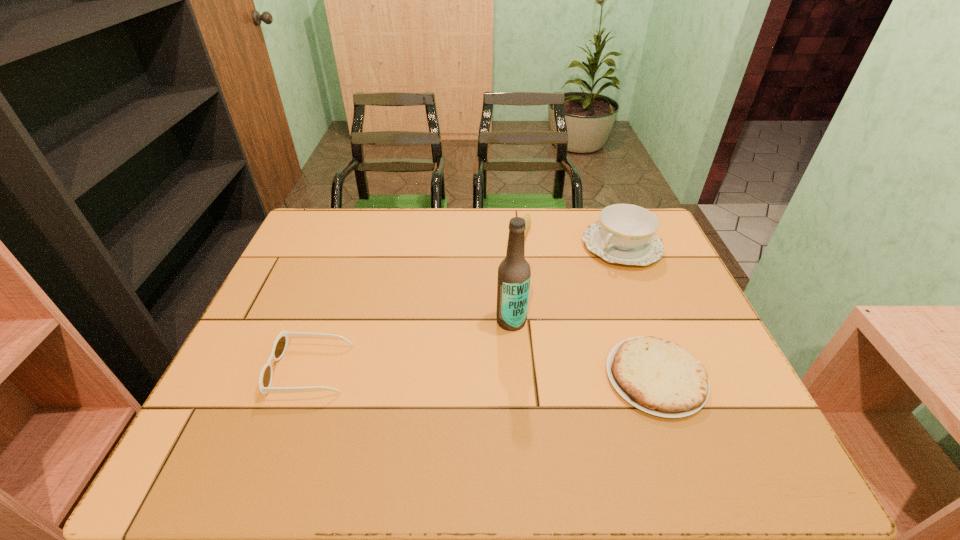
At what (x,y) coordinates should I click in order to perform the action: click on sunglasses that is at the near edge. Please return your answer as a coordinate pair (x, y). Image resolution: width=960 pixels, height=540 pixels. Looking at the image, I should click on (280, 345).

You are a GUI agent. You are given a task and a screenshot of the screen. Output one action in this format:
    pyautogui.click(x=<x>, y=<y>)
    Task: Click on the tortilla at the near edge
    This screenshot has height=540, width=960.
    Given the screenshot: What is the action you would take?
    pyautogui.click(x=659, y=377)

Identify the location of object situated at the left edge. The image size is (960, 540). (280, 345).

The image size is (960, 540). I want to click on tortilla positioned at the right edge, so click(659, 377).

Image resolution: width=960 pixels, height=540 pixels. I want to click on chinaware located in the right edge section of the desktop, so click(626, 234).

Where is `object positioned at the near left corner`? This screenshot has height=540, width=960. object positioned at the near left corner is located at coordinates (280, 345).

Where is `object that is positioned at the far right corner`? The image size is (960, 540). object that is positioned at the far right corner is located at coordinates (626, 234).

Locate an element on the screen. object at the near right corner is located at coordinates (659, 377).

Locate an element on the screen. This screenshot has width=960, height=540. vacant space at the far edge of the desktop is located at coordinates pos(429,240).

This screenshot has width=960, height=540. In the image, there is a desktop. What are the coordinates of `free space at the near edge` in the screenshot? It's located at (523, 418).